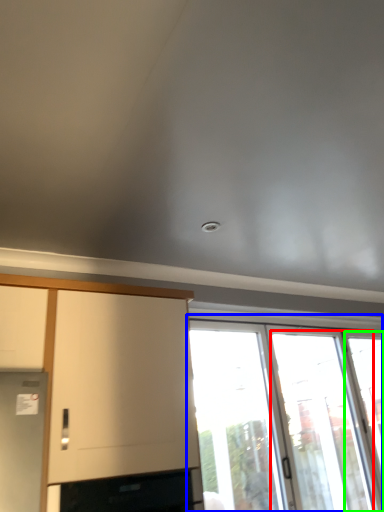
Question: Estimate the real-world distances between objects in this image. Which object is closer to screen door (highlighted by a red box), window (highlighted by a blue box) or window (highlighted by a green box)?

Choices:
 (A) window
 (B) window

Answer: (A)